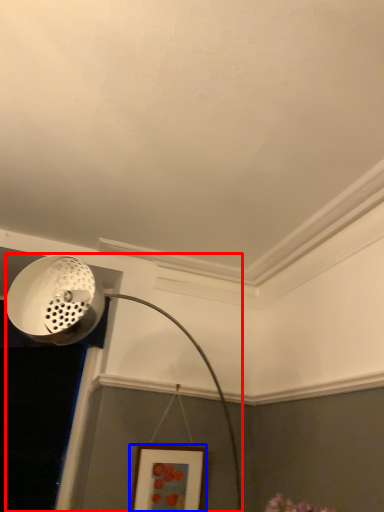
Question: Which object appears closest to the camera in this image, lamp (highlighted by a red box) or picture frame (highlighted by a blue box)?

Choices:
 (A) lamp
 (B) picture frame

Answer: (A)